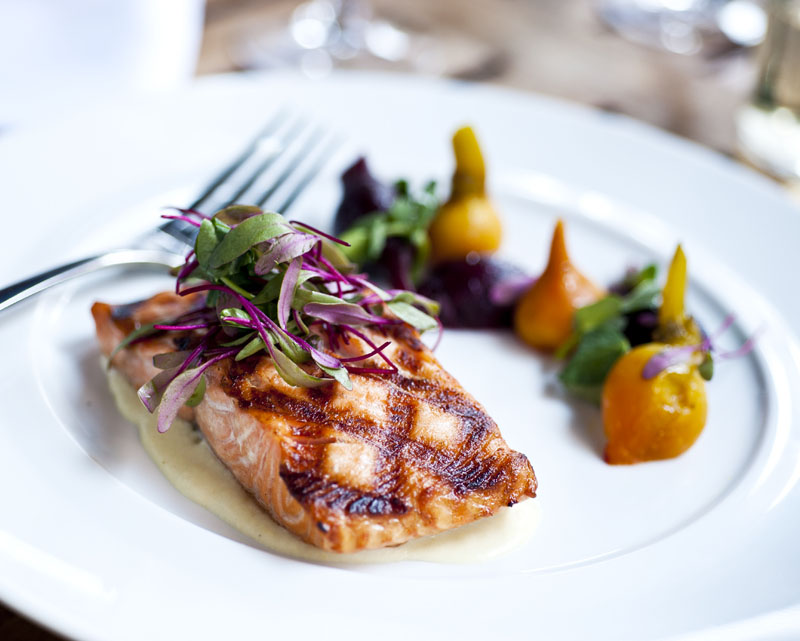
This screenshot has height=641, width=800. I want to click on fork, so click(x=150, y=247).